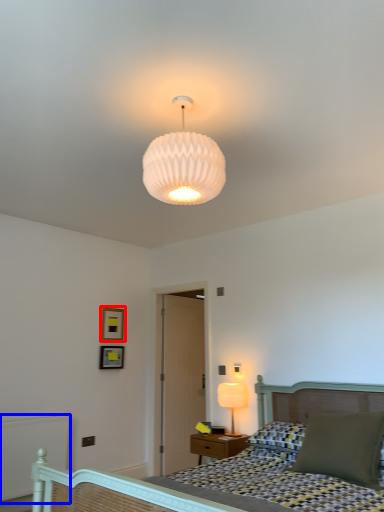
Question: Which point is closer to the camera, picture frame (highlighted by a red box) or balustrade (highlighted by a blue box)?

Choices:
 (A) picture frame
 (B) balustrade

Answer: (B)